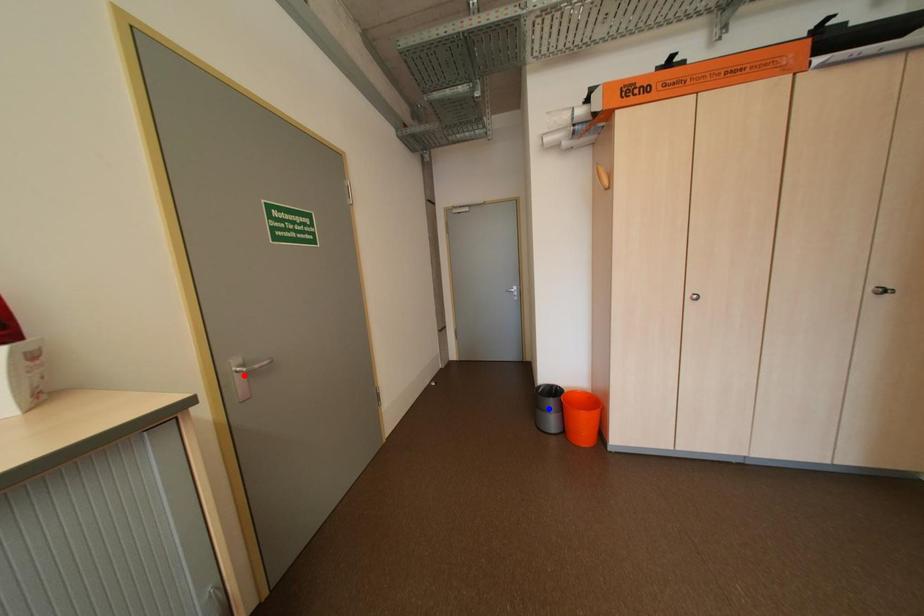
Question: Which of the two points in the image is closer to the camera?

Choices:
 (A) Blue point is closer.
 (B) Red point is closer.

Answer: (B)